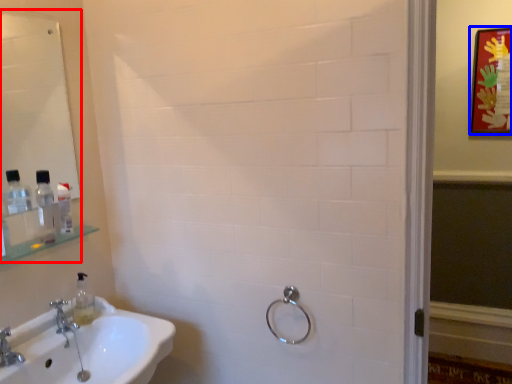
Question: Which of the following is the farthest to the observer, mirror (highlighted by a red box) or picture frame (highlighted by a blue box)?

Choices:
 (A) mirror
 (B) picture frame

Answer: (B)